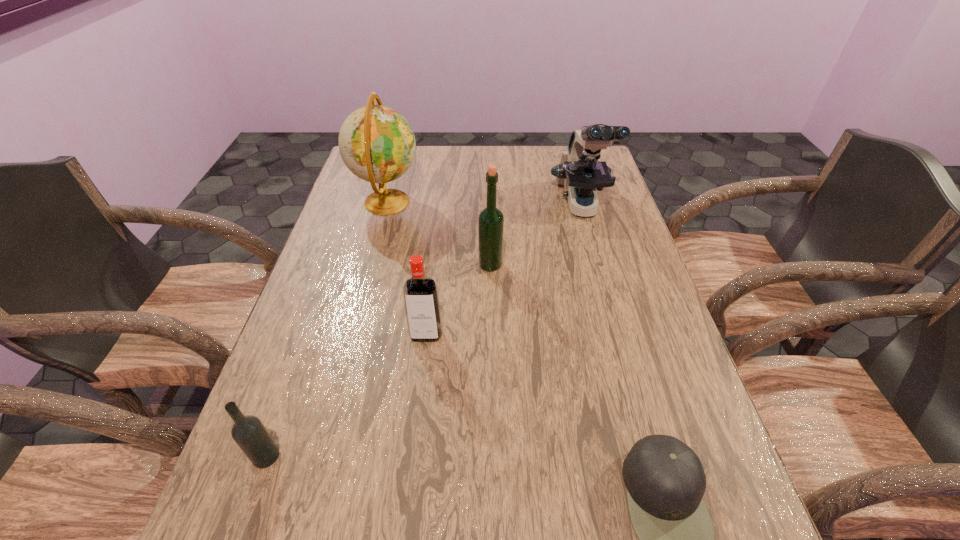
This screenshot has width=960, height=540. Identify the location of globe. (377, 144).

Find the location of a particular element. microscope is located at coordinates (580, 172).

Where is `the fourth object from left to right`? This screenshot has width=960, height=540. the fourth object from left to right is located at coordinates (x=490, y=220).

You are a GUI agent. You are given a task and a screenshot of the screen. Output one action in this format:
    pyautogui.click(x=<x>, y=<y>)
    Task: Click on the fourth nearest object
    
    Given the screenshot: What is the action you would take?
    pyautogui.click(x=490, y=220)

You are a GUI agent. You are given a task and a screenshot of the screen. Output one action in this format:
    pyautogui.click(x=<x>, y=<y>)
    Task: Click on the fourth tallest object
    The width and height of the screenshot is (960, 540).
    Given the screenshot: What is the action you would take?
    pyautogui.click(x=420, y=293)

The width and height of the screenshot is (960, 540). I want to click on the right vodka, so click(420, 293).

The image size is (960, 540). What are the coordinates of `the nearer vodka` in the screenshot? It's located at (249, 433).

Locate an element on the screen. the shorter vodka is located at coordinates (249, 433).

This screenshot has width=960, height=540. I want to click on free region located on the back of the globe, so click(397, 161).

You are a GUI agent. You are given a task and a screenshot of the screen. Output one action in this format:
    pyautogui.click(x=<x>, y=<y>)
    Task: Click on the vacant space located 0.300m through the eyepieces of the microscope
    This screenshot has height=540, width=960.
    Given the screenshot: What is the action you would take?
    pyautogui.click(x=612, y=314)